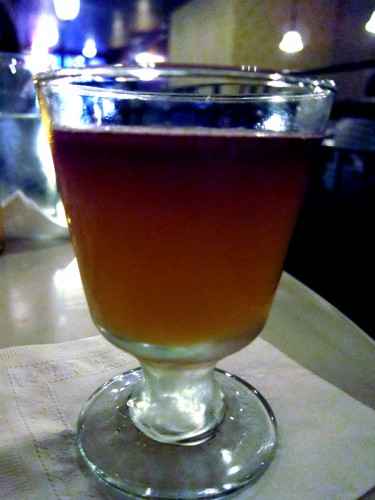
Identify the location of lights. (44, 32), (68, 8), (90, 52), (143, 59), (292, 44), (373, 22).